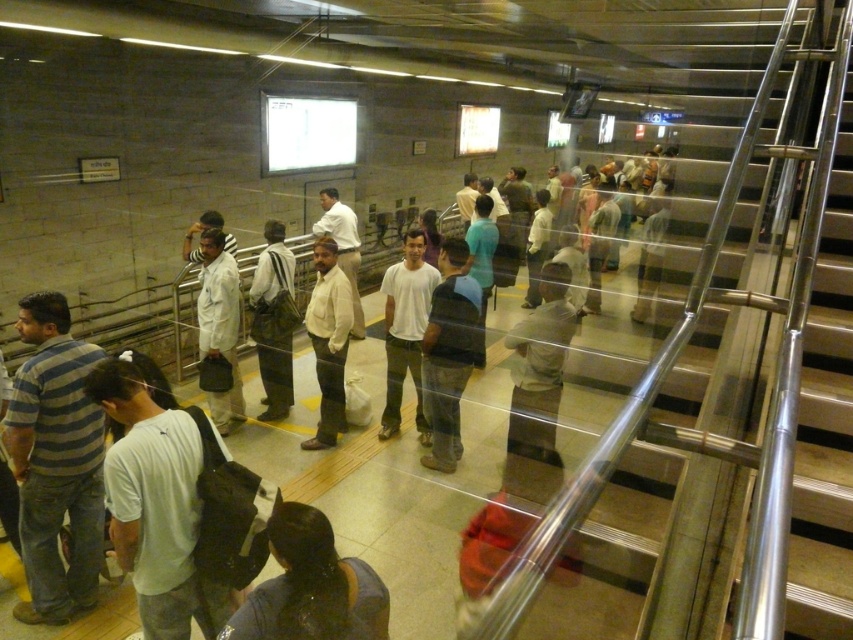
You are a delivery robot with a 2.5 feet wide package. You need to navigate through the crowd in the subway station. Can you pass between the dark blue shirt at center and the light brown leather jacket at center without moving the people?

The distance between the dark blue shirt at center and the light brown leather jacket at center is 9.13 feet. Since your package is 2.5 feet wide, there is enough space to pass between them without needing to move the people.

You are standing at the bottom of the staircase in the subway station and notice two people wearing a striped cotton shirt at center and a light gray shirt at center. Which person is closer to you?

The striped cotton shirt at center is closer to you because it is positioned further to the viewer than the light gray shirt at center.